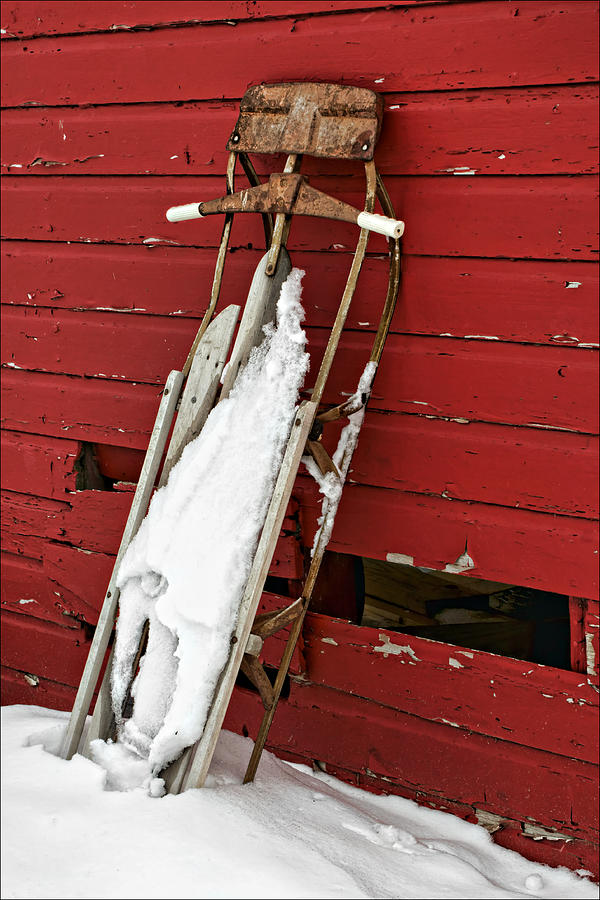
You are a GUI agent. You are given a task and a screenshot of the screen. Output one action in this format:
    pyautogui.click(x=<x>, y=<y>)
    Task: Click on the left handle
    
    Given the screenshot: What is the action you would take?
    pyautogui.click(x=182, y=208)